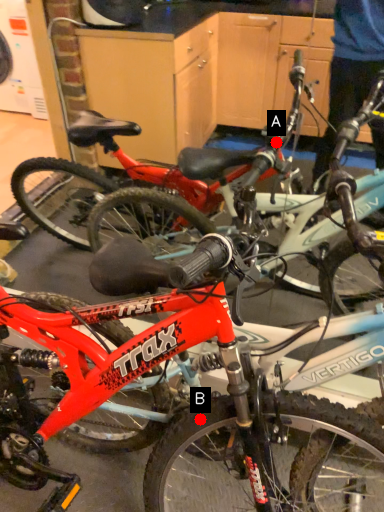
Question: Two points are circled on the image, labeled by A and B beside each circle. Among these points, which one is nearest to the camera?

Choices:
 (A) A is closer
 (B) B is closer

Answer: (B)